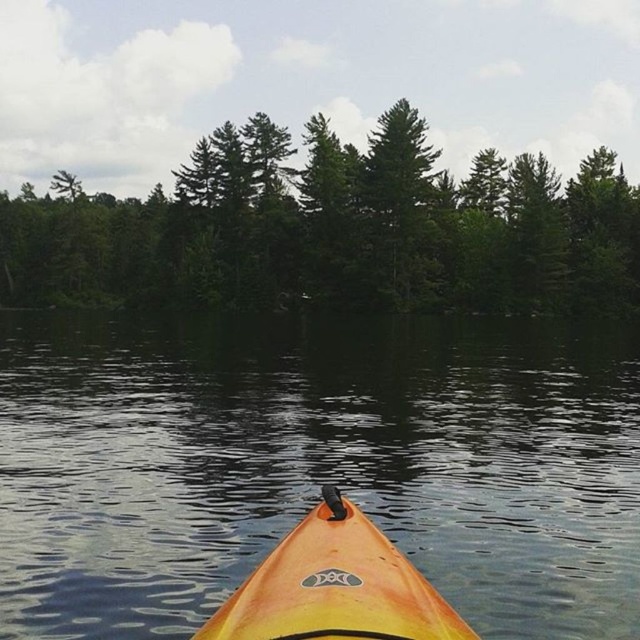
Which is below, orange/yellow kayak at lower center or orange matte kayak at lower center?

orange matte kayak at lower center is below.

In the scene shown: Is orange/yellow kayak at lower center above orange matte kayak at lower center?

Yes.

Find the location of a particular element. The image size is (640, 640). orange/yellow kayak at lower center is located at coordinates (316, 464).

Is orange/yellow kayak at lower center further to the viewer compared to green matte tree at upper center?

No, it is in front of green matte tree at upper center.

Is orange/yellow kayak at lower center thinner than green matte tree at upper center?

Yes.

Is point (189, 596) behind point (321, 236)?

No, it is in front of (321, 236).

You are a GUI agent. You are given a task and a screenshot of the screen. Output one action in this format:
    pyautogui.click(x=<x>, y=<y>)
    Task: Click on the orange/yellow kayak at lower center
    This screenshot has height=640, width=640.
    Given the screenshot: What is the action you would take?
    click(x=316, y=464)

Which is behind, point (81, 220) or point (294, 580)?

The point (81, 220) is more distant.

Does green matte tree at upper center appear under orange matte kayak at lower center?

Incorrect, green matte tree at upper center is not positioned below orange matte kayak at lower center.

Image resolution: width=640 pixels, height=640 pixels. What do you see at coordinates (333, 228) in the screenshot?
I see `green matte tree at upper center` at bounding box center [333, 228].

Find the location of a particular element. green matte tree at upper center is located at coordinates (333, 228).